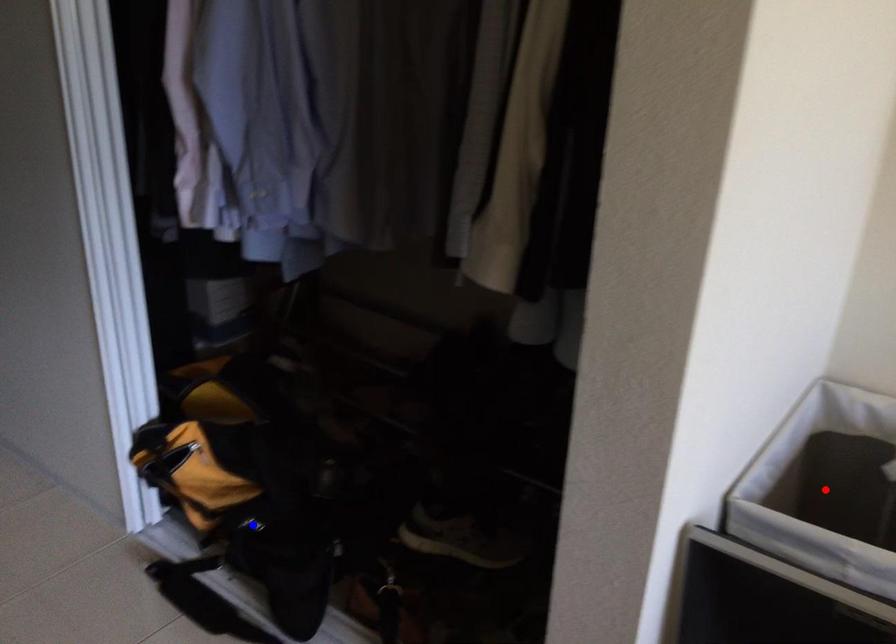
Question: Two points are marked on the image. Which point is closer to the camera?

Choices:
 (A) Blue point is closer.
 (B) Red point is closer.

Answer: (B)